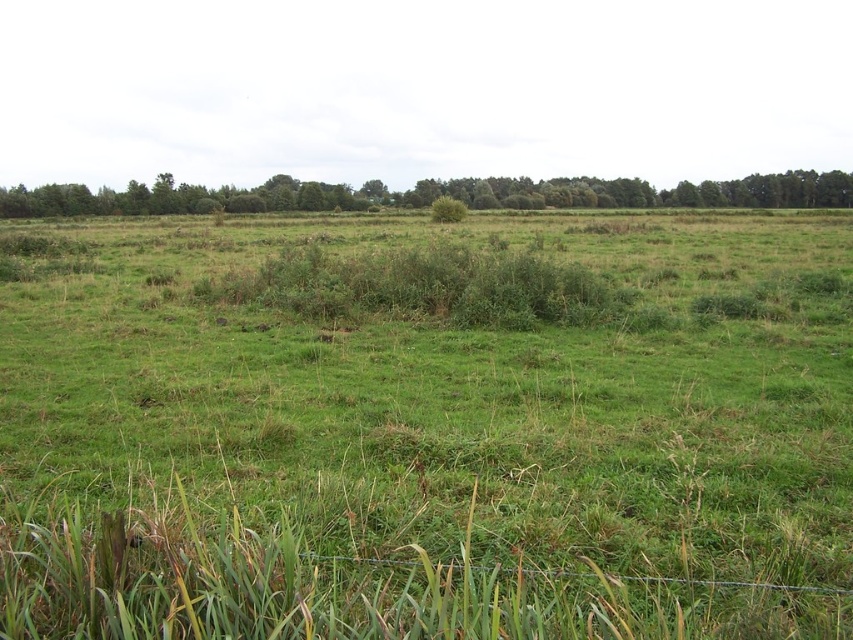
Can you confirm if green grassy pasture at center is shorter than green leafy trees at upper center?

Yes.

Which of these two, green grassy pasture at center or green leafy trees at upper center, stands taller?

green leafy trees at upper center is taller.

The width and height of the screenshot is (853, 640). What do you see at coordinates (426, 428) in the screenshot? I see `green grassy pasture at center` at bounding box center [426, 428].

Locate an element on the screen. green grassy pasture at center is located at coordinates (426, 428).